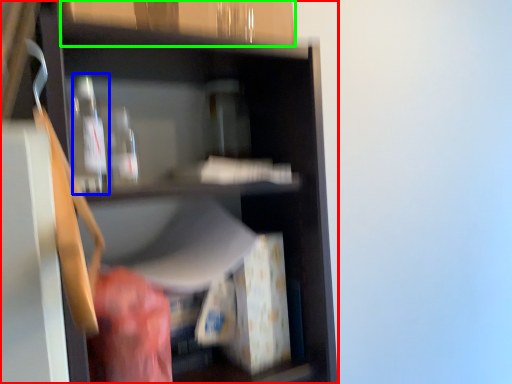
Question: Which is nearer to the shelf (highlighted by a red box)? bottle (highlighted by a blue box) or cabinetry (highlighted by a green box).

Choices:
 (A) bottle
 (B) cabinetry

Answer: (A)